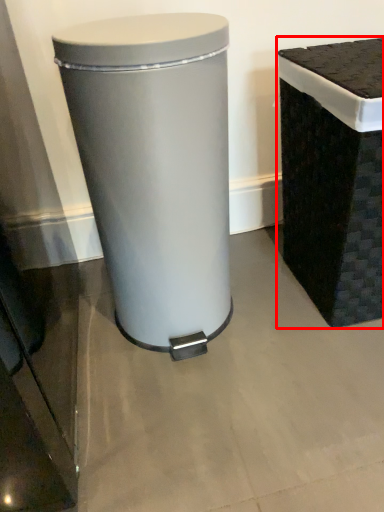
Question: From the image's perspective, what is the correct spatial positioning of waste container (annotated by the red box) in reference to waste container?

Choices:
 (A) below
 (B) above

Answer: (B)